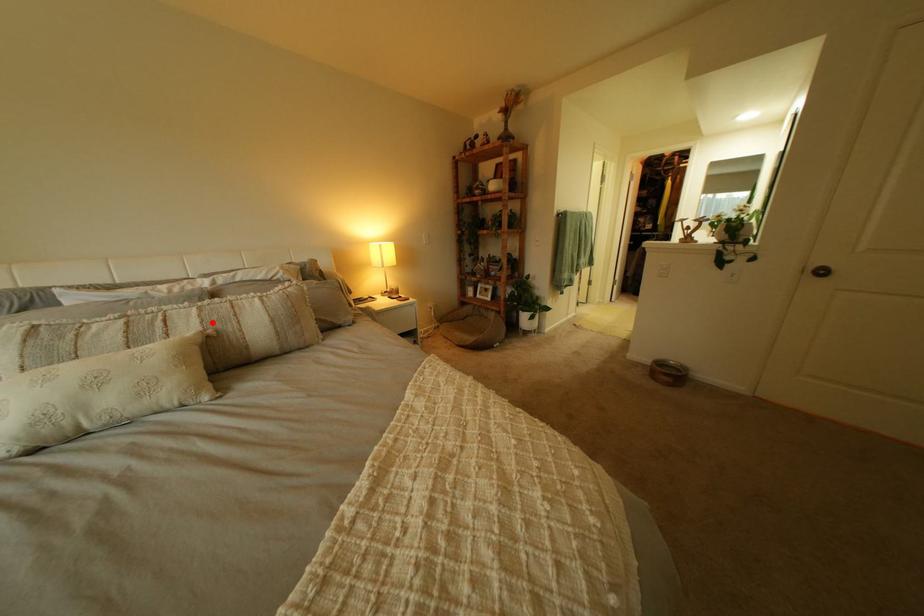
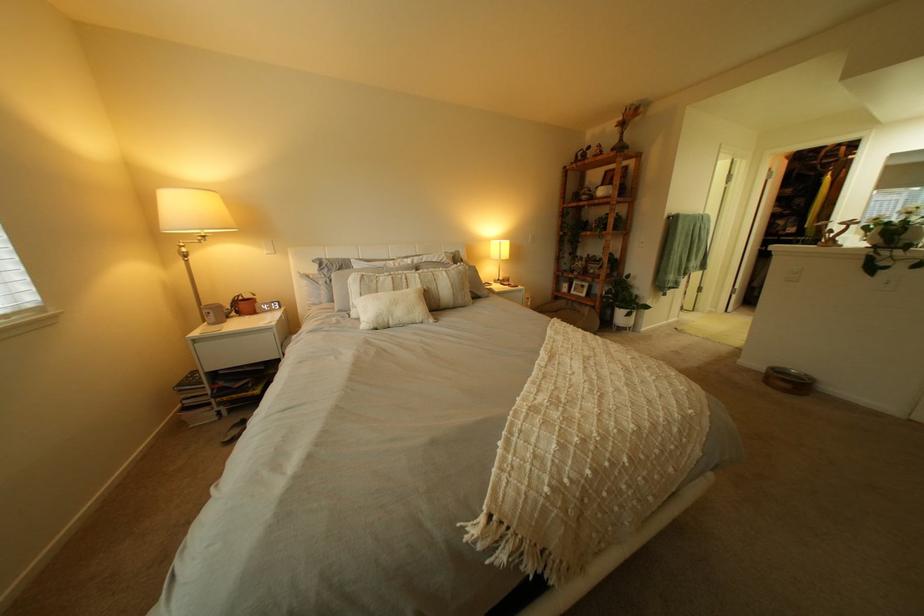
Question: I am providing you with two images of the same scene from different viewpoints. A red point is marked on the first image. At the location where the point appears in image 1, is it still visible in image 2?

Choices:
 (A) Yes
 (B) No

Answer: (A)